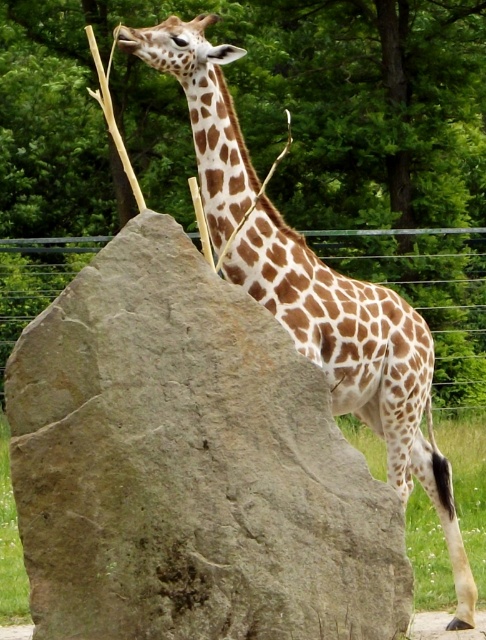
You are a zookeeper trying to place a new feeding trough between the gray rough rock at center and the spotted fur giraffe at center. Based on their positions, where should the feeding trough be placed to ensure it is between both objects?

The feeding trough should be placed between the gray rough rock at center and the spotted fur giraffe at center. Since the gray rough rock at center is located below the spotted fur giraffe at center, the trough should be positioned in the middle area between them vertically.